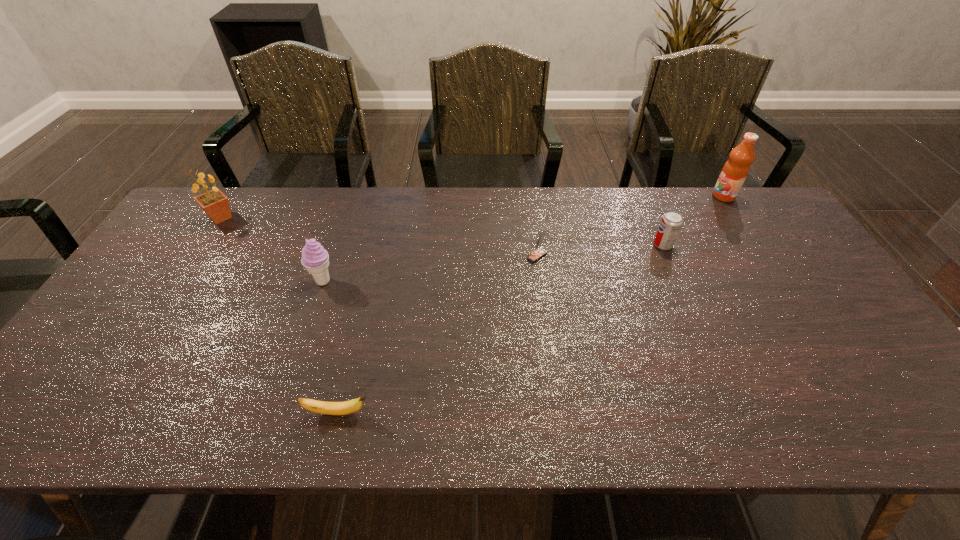
Where is `fruit juice`? fruit juice is located at coordinates (736, 169).

At what (x,y) coordinates should I click in order to perform the action: click on the rightmost object. Please return your answer as a coordinate pair (x, y). Looking at the image, I should click on (736, 169).

The image size is (960, 540). I want to click on the leftmost object, so click(x=215, y=204).

Locate an element on the screen. This screenshot has height=540, width=960. the second farthest object is located at coordinates tap(215, 204).

The height and width of the screenshot is (540, 960). Identify the location of the fourth shortest object. (315, 259).

At what (x,y) coordinates should I click in order to perform the action: click on icecream. Please return your answer as a coordinate pair (x, y). Looking at the image, I should click on (315, 259).

Identify the location of matchbox. The image size is (960, 540). (539, 253).

At what (x,y) coordinates should I click in order to perform the action: click on soda. Please return your answer as a coordinate pair (x, y). Image resolution: width=960 pixels, height=540 pixels. Looking at the image, I should click on coord(671,222).

This screenshot has width=960, height=540. I want to click on banana, so click(347, 407).

Locate an element on the screen. The image size is (960, 540). the fourth object from right to left is located at coordinates (347, 407).